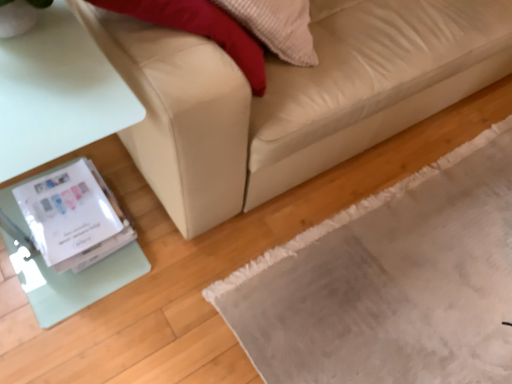
Question: Based on their positions, is white glossy wii at lower left located to the left or right of gray textured mat at lower right?

Choices:
 (A) left
 (B) right

Answer: (A)

Question: Is white glossy wii at lower left in front of or behind gray textured mat at lower right in the image?

Choices:
 (A) front
 (B) behind

Answer: (B)

Question: Which of these objects is positioned closest to the white glossy wii at lower left?

Choices:
 (A) gray textured mat at lower right
 (B) beige leather couch at lower left

Answer: (B)

Question: Estimate the real-world distances between objects in this image. Which object is farther from the gray textured mat at lower right?

Choices:
 (A) white glossy wii at lower left
 (B) beige leather couch at lower left

Answer: (A)